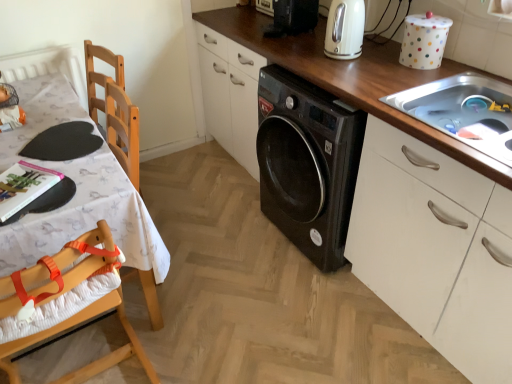
Find the location of `free space to the right of wooden table at left`. free space to the right of wooden table at left is located at coordinates (204, 273).